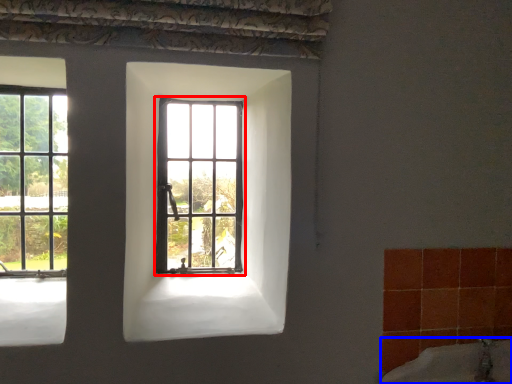
Question: Among these objects, which one is nearest to the camera, window (highlighted by a red box) or bath (highlighted by a blue box)?

Choices:
 (A) window
 (B) bath

Answer: (B)